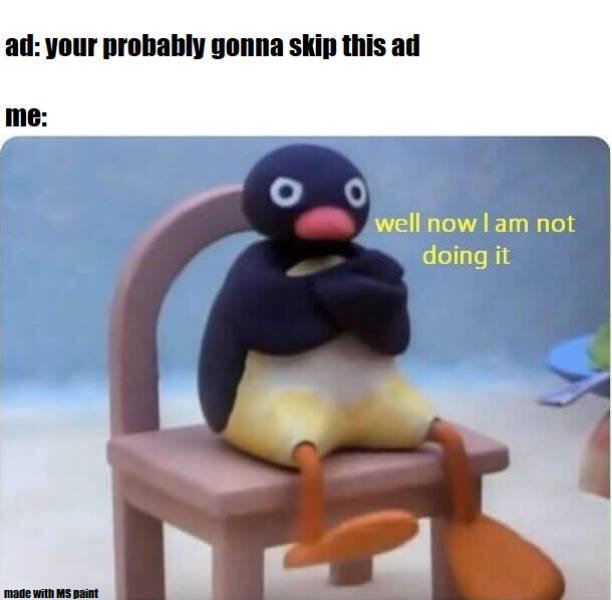
Image resolution: width=612 pixels, height=600 pixels. I want to click on digital image of a penguin sitting in a chair, so click(297, 379).